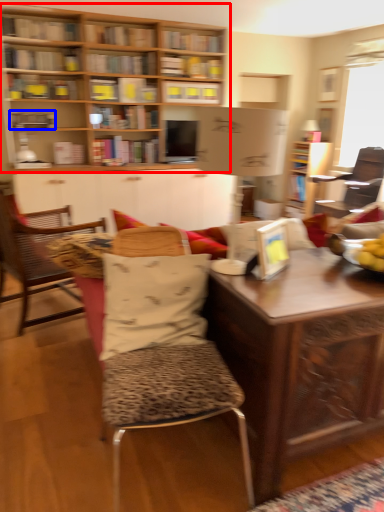
Question: Which point is further to the camera, bookcase (highlighted by a red box) or book (highlighted by a blue box)?

Choices:
 (A) bookcase
 (B) book

Answer: (B)